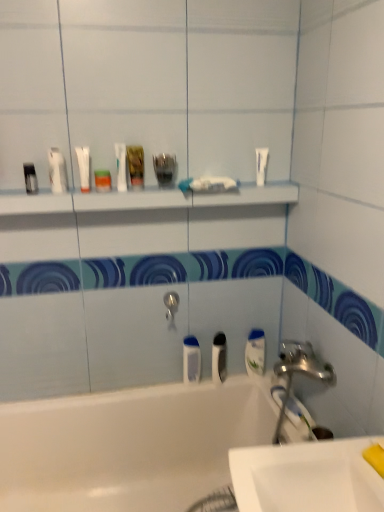
Question: Can you confirm if white glossy sink at lower right is bigger than white glossy bathtub at lower left?

Choices:
 (A) no
 (B) yes

Answer: (A)

Question: Is white glossy sink at lower right wider than white glossy bathtub at lower left?

Choices:
 (A) no
 (B) yes

Answer: (A)

Question: Considering the relative sizes of white glossy sink at lower right and white glossy bathtub at lower left in the image provided, is white glossy sink at lower right shorter than white glossy bathtub at lower left?

Choices:
 (A) yes
 (B) no

Answer: (A)

Question: Considering the relative positions of white glossy sink at lower right and white glossy bathtub at lower left in the image provided, is white glossy sink at lower right to the right of white glossy bathtub at lower left from the viewer's perspective?

Choices:
 (A) no
 (B) yes

Answer: (B)

Question: Does white glossy sink at lower right appear on the left side of white glossy bathtub at lower left?

Choices:
 (A) yes
 (B) no

Answer: (B)

Question: In terms of size, does white plastic toothbrush at lower right appear bigger or smaller than black plastic toothbrush at center, the 4th mouthwash positioned from the top?

Choices:
 (A) small
 (B) big

Answer: (A)

Question: In terms of height, does white plastic toothbrush at lower right look taller or shorter compared to black plastic toothbrush at center, which is the second mouthwash from bottom to top?

Choices:
 (A) short
 (B) tall

Answer: (A)

Question: In the image, is white plastic toothbrush at lower right positioned in front of or behind black plastic toothbrush at center, which is the second mouthwash from bottom to top?

Choices:
 (A) behind
 (B) front

Answer: (B)

Question: Considering the relative positions of white plastic toothbrush at lower right and black plastic toothbrush at center, which is the second mouthwash from bottom to top, in the image provided, is white plastic toothbrush at lower right to the left or to the right of black plastic toothbrush at center, which is the second mouthwash from bottom to top,?

Choices:
 (A) right
 (B) left

Answer: (A)

Question: Is white glossy tube at upper center, arranged as the 5th mouthwash when viewed from the right, taller or shorter than white matte tube at upper left, the second toiletry when ordered from right to left?

Choices:
 (A) tall
 (B) short

Answer: (B)

Question: Is white glossy tube at upper center, arranged as the 5th mouthwash when viewed from the right, situated inside white matte tube at upper left, the second toiletry when ordered from right to left, or outside?

Choices:
 (A) inside
 (B) outside

Answer: (B)

Question: Considering the positions of white glossy tube at upper center, arranged as the first mouthwash when viewed from the left, and white matte tube at upper left, the second toiletry when ordered from right to left, in the image, is white glossy tube at upper center, arranged as the first mouthwash when viewed from the left, bigger or smaller than white matte tube at upper left, the second toiletry when ordered from right to left,?

Choices:
 (A) big
 (B) small

Answer: (B)

Question: From the image's perspective, relative to white matte tube at upper left, the second toiletry when ordered from right to left, is white glossy tube at upper center, arranged as the 5th mouthwash when viewed from the right, above or below?

Choices:
 (A) below
 (B) above

Answer: (B)

Question: From a real-world perspective, is white matte tube at upper left, the 2th toiletry positioned from the left, positioned above or below silver metallic tap at center?

Choices:
 (A) above
 (B) below

Answer: (A)

Question: Considering their positions, is white matte tube at upper left, the second toiletry when ordered from right to left, located in front of or behind silver metallic tap at center?

Choices:
 (A) front
 (B) behind

Answer: (A)